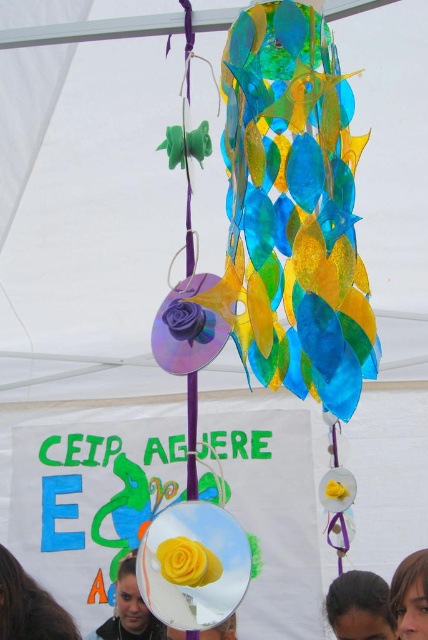
Between brown hair at lower left and smooth brown hair at lower right, which one has less height?

With less height is smooth brown hair at lower right.

Who is more forward, (65, 618) or (419, 560)?

Positioned in front is point (419, 560).

This screenshot has width=428, height=640. I want to click on brown hair at lower left, so click(29, 605).

Can you confirm if smooth brown hair at lower right is positioned above smooth skin face at lower center?

Correct, smooth brown hair at lower right is located above smooth skin face at lower center.

Who is higher up, smooth brown hair at lower right or smooth skin face at lower center?

smooth brown hair at lower right is above.

Does point (397, 593) come farther from viewer compared to point (225, 625)?

No, it is in front of (225, 625).

Where is `smooth brown hair at lower right`? This screenshot has height=640, width=428. smooth brown hair at lower right is located at coordinates (410, 596).

Who is positioned more to the right, matte yellow hair at lower center or smooth brown hair at lower right?

From the viewer's perspective, smooth brown hair at lower right appears more on the right side.

Does matte yellow hair at lower center appear over smooth brown hair at lower right?

No, matte yellow hair at lower center is not above smooth brown hair at lower right.

Which is behind, point (139, 634) or point (416, 579)?

Point (139, 634)

I want to click on matte yellow hair at lower center, so click(128, 609).